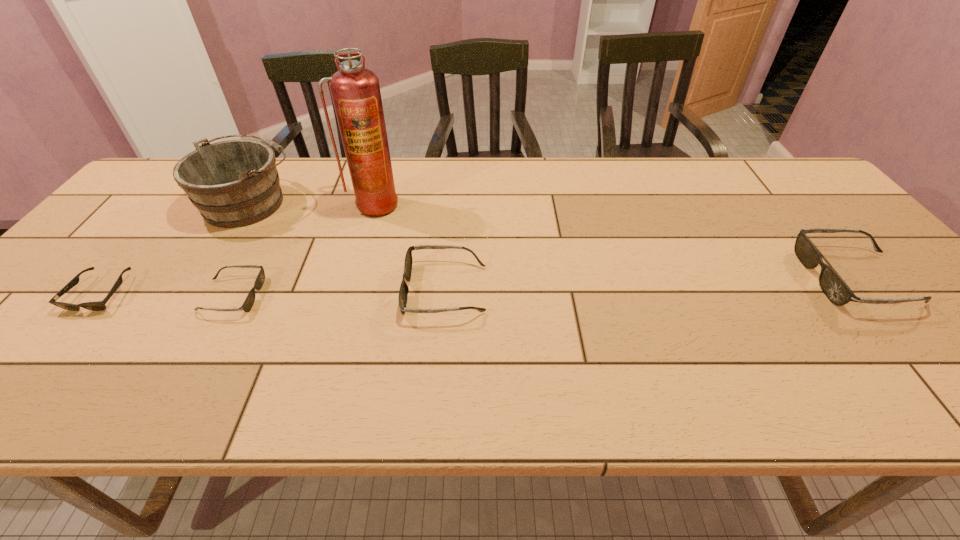
This screenshot has width=960, height=540. I want to click on the third sunglasses from right to left, so click(249, 301).

Where is `the third shortest object`? The height and width of the screenshot is (540, 960). the third shortest object is located at coordinates (403, 291).

The image size is (960, 540). Find the location of `the fifth object from left to right`. the fifth object from left to right is located at coordinates (403, 291).

You are a GUI agent. You are given a task and a screenshot of the screen. Output one action in this format:
    pyautogui.click(x=<x>, y=<y>)
    Task: Click on the rightmost sunglasses
    
    Given the screenshot: What is the action you would take?
    pyautogui.click(x=833, y=286)

Find the location of a particular element. Image resolution: width=960 pixels, height=540 pixels. fire extinguisher is located at coordinates (355, 90).

This screenshot has height=540, width=960. In order to click on the third object from right to left in this screenshot , I will do `click(355, 90)`.

At what (x,y) coordinates should I click in order to perform the action: click on wine bucket. Please return your answer as a coordinate pair (x, y). This screenshot has width=960, height=540. Looking at the image, I should click on (234, 183).

At what (x,y) coordinates should I click in order to perform the action: click on the leftmost object. Please return your answer as a coordinate pair (x, y). This screenshot has width=960, height=540. Looking at the image, I should click on (97, 305).

Find the location of `free spot located 0.280m on the front-facing side of the third sunglasses from right to left`. free spot located 0.280m on the front-facing side of the third sunglasses from right to left is located at coordinates (380, 296).

At what (x,y) coordinates should I click in order to perform the action: click on free space located on the front-facing side of the fourth tallest object. Please return your answer as a coordinate pair (x, y). Looking at the image, I should click on (328, 289).